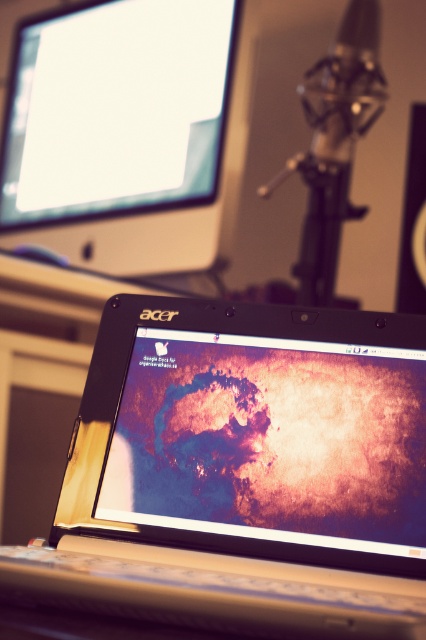
Question: Which of the following is the closest to the observer?

Choices:
 (A) matte black monitor at upper left
 (B) metallic silver laptop at center

Answer: (B)

Question: Does metallic silver laptop at center appear under matte black monitor at upper left?

Choices:
 (A) no
 (B) yes

Answer: (B)

Question: Which point is closer to the camera?

Choices:
 (A) metallic silver laptop at center
 (B) metallic silver speaker at center

Answer: (A)

Question: Can you confirm if metallic silver laptop at center is positioned to the left of metallic silver speaker at center?

Choices:
 (A) no
 (B) yes

Answer: (B)

Question: Considering the real-world distances, which object is farthest from the metallic silver speaker at center?

Choices:
 (A) matte black monitor at upper left
 (B) metallic silver laptop at center

Answer: (B)

Question: From the image, what is the correct spatial relationship of metallic silver laptop at center in relation to metallic silver speaker at center?

Choices:
 (A) left
 (B) right

Answer: (A)